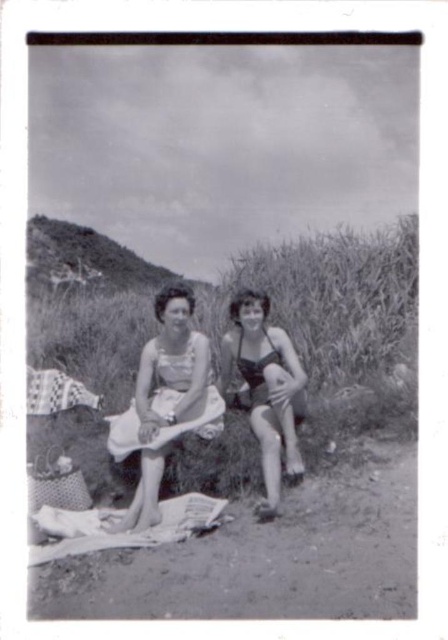
Which of these two, matte black swimsuit at center or grassy hillside at upper left, stands taller?

matte black swimsuit at center

Is matte black swimsuit at center behind grassy hillside at upper left?

No, it is in front of grassy hillside at upper left.

Describe the element at coordinates (266, 388) in the screenshot. I see `matte black swimsuit at center` at that location.

In order to click on matte black swimsuit at center in this screenshot , I will do `click(266, 388)`.

Describe the element at coordinates (164, 403) in the screenshot. This screenshot has width=448, height=640. I see `matte white dress at center` at that location.

Does point (192, 355) lie in front of point (258, 294)?

Yes.

Does point (156, 348) come closer to viewer compared to point (265, 506)?

No.

Identify the location of matte white dress at center. (164, 403).

Is point (255, 426) more distant than point (203, 433)?

That is False.

Is matte black swimsuit at center thinner than white cloth at center?

Indeed, matte black swimsuit at center has a lesser width compared to white cloth at center.

Where is `matte black swimsuit at center`? matte black swimsuit at center is located at coordinates (266, 388).

Locate an element on the screen. The width and height of the screenshot is (448, 640). matte black swimsuit at center is located at coordinates (266, 388).